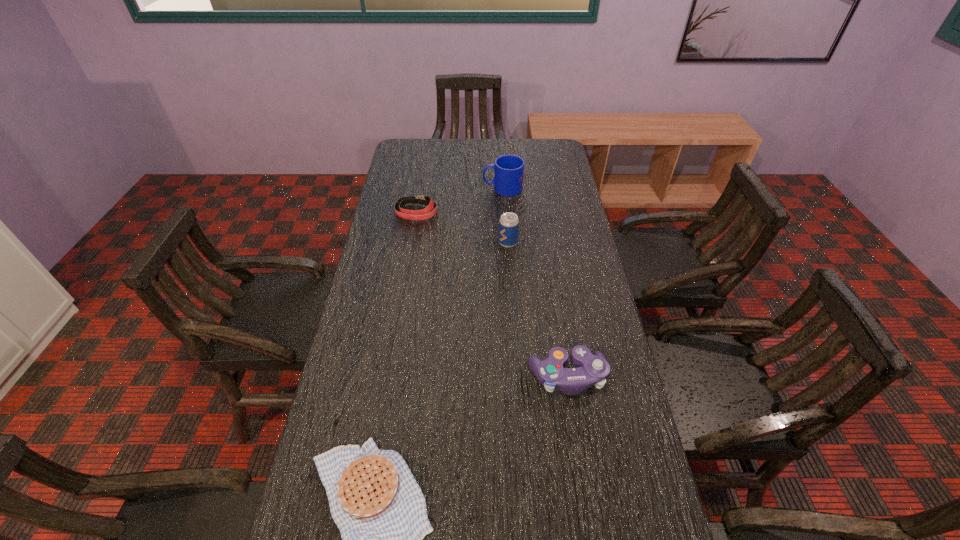
The width and height of the screenshot is (960, 540). Identify the location of vacant point located between the fourth farthest object and the third nearest object. (538, 310).

Where is `object that is the second closest to the farthest object`? The height and width of the screenshot is (540, 960). object that is the second closest to the farthest object is located at coordinates (508, 223).

This screenshot has height=540, width=960. Identify the location of the fourth closest object to the second farthest object. 380,510.

Locate an element on the screen. The height and width of the screenshot is (540, 960). free location that satisfies the following two spatial constraints: 1. on the side with the handle of the mug; 2. on the left side of the beer can is located at coordinates (506, 243).

At what (x,y) coordinates should I click in order to perform the action: click on vacant area that satisfies the following two spatial constraints: 1. on the side with the handle of the mug; 2. on the right side of the beer can. Please return your answer as a coordinate pair (x, y). This screenshot has height=540, width=960. Looking at the image, I should click on (506, 243).

Find the location of `free space that satisfies the following two spatial constraints: 1. on the side with the handle of the farthest object; 2. on the front side of the dog collar`. free space that satisfies the following two spatial constraints: 1. on the side with the handle of the farthest object; 2. on the front side of the dog collar is located at coordinates (504, 212).